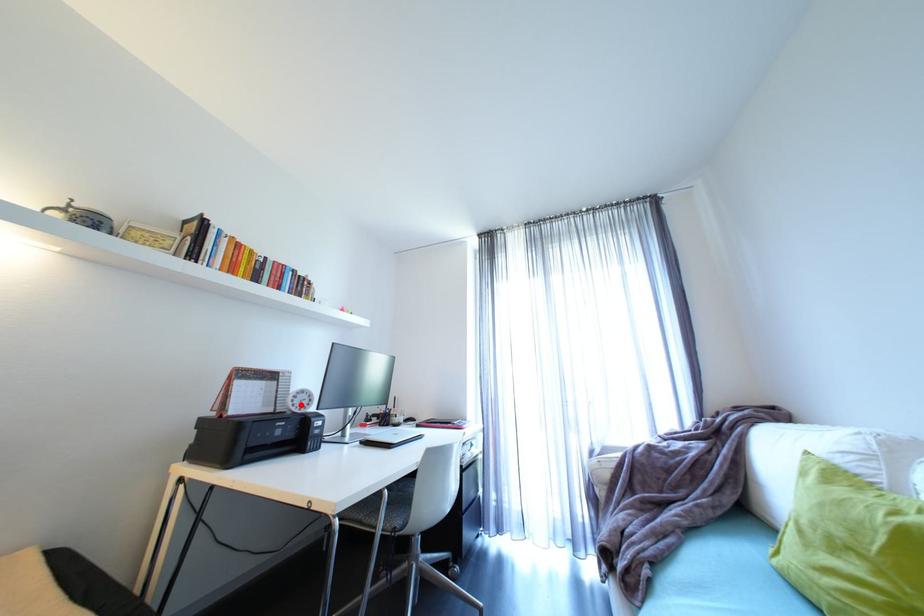
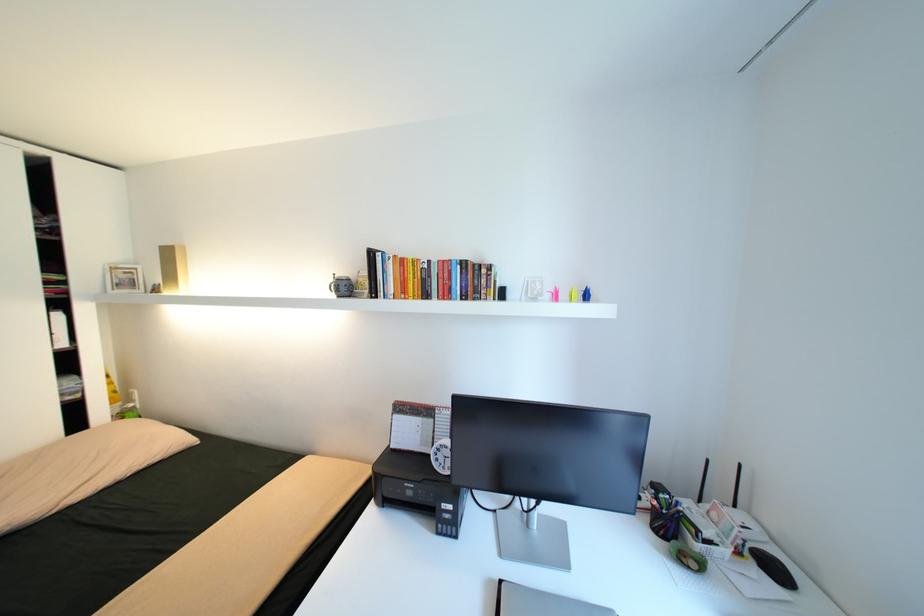
Where in the second image is the point corresponding to the highlighted location from the first image?

(444, 460)